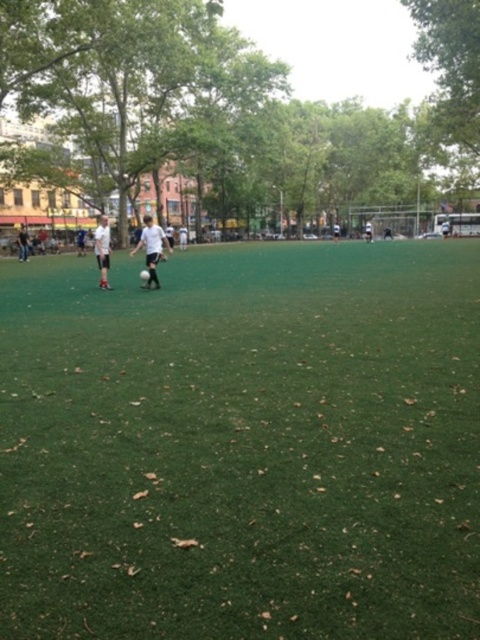
Is white matte soccer player at center positioned before white matte soccer player at left?

Yes, white matte soccer player at center is in front of white matte soccer player at left.

Does point (107, 236) come in front of point (22, 248)?

Yes, it is in front of point (22, 248).

Locate an element on the screen. white matte soccer player at center is located at coordinates (103, 250).

Who is higher up, green artificial turf at center or white matte soccer player at left?

white matte soccer player at left is higher up.

How much distance is there between green artificial turf at center and white matte soccer player at left?

green artificial turf at center is 70.25 feet away from white matte soccer player at left.

Measure the distance between point (x=416, y=278) and camera.

Point (x=416, y=278) and camera are 15.18 meters apart.

Locate an element on the screen. green artificial turf at center is located at coordinates (242, 445).

Which is below, white matte soccer ball at center or white matte soccer player at left?

white matte soccer player at left is lower down.

Which is in front, point (153, 268) or point (20, 232)?

Positioned in front is point (153, 268).

Which is behind, point (144, 237) or point (24, 243)?

Positioned behind is point (24, 243).

In order to click on white matte soccer ball at center in this screenshot , I will do [152, 248].